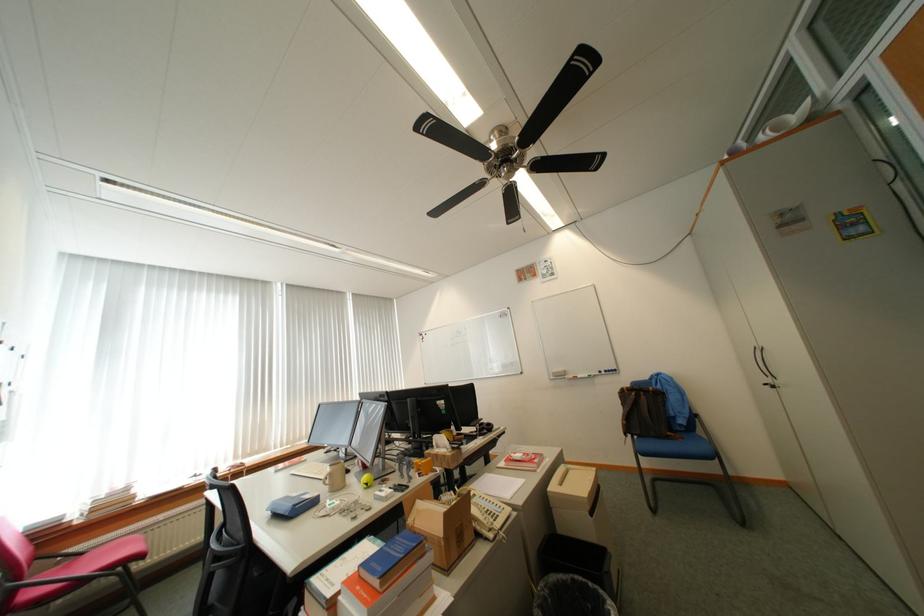
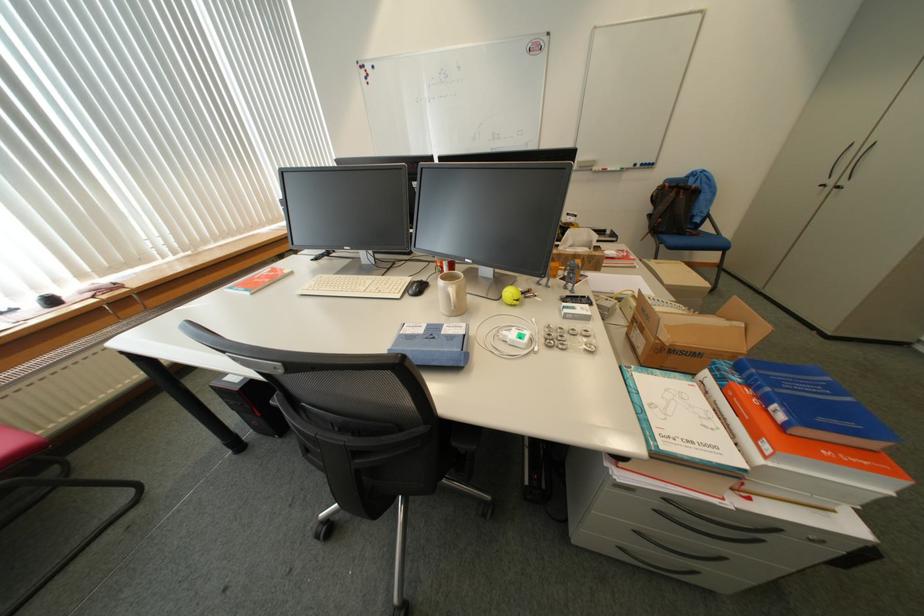
Where in the second image is the point corresponding to (x=305, y=496) from the first image?

(430, 331)